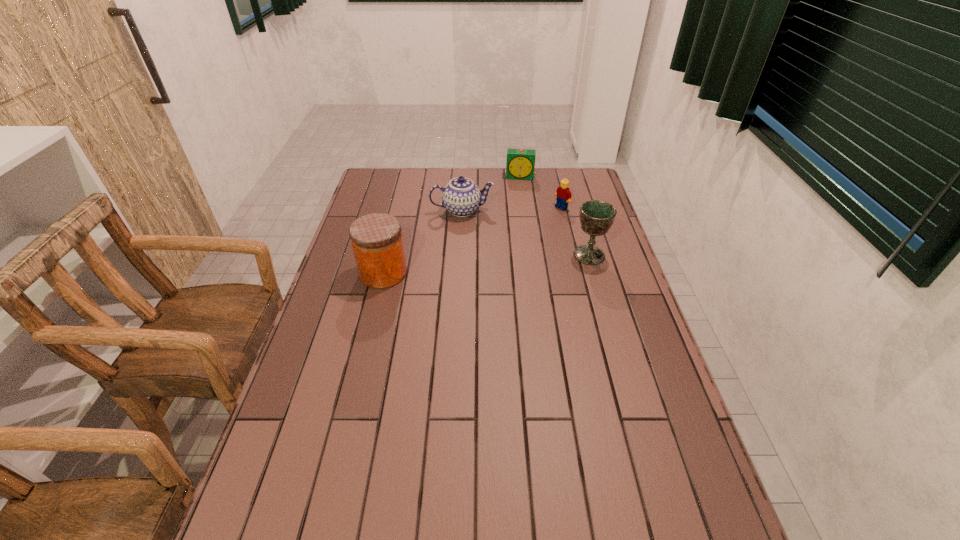
Identify the location of blank region between the chalice and the Lego. This screenshot has width=960, height=540. (575, 231).

Find the location of `empty space between the farthest object and the chalice`. empty space between the farthest object and the chalice is located at coordinates (555, 216).

At what (x,y) coordinates should I click in order to perform the action: click on blank region between the leftmost object and the second object from left to right. Please return your answer as a coordinate pair (x, y). Looking at the image, I should click on (422, 242).

You are a GUI agent. You are given a task and a screenshot of the screen. Output one action in this format:
    pyautogui.click(x=<x>, y=<y>)
    Task: Click on the unoccupied position between the third tallest object and the chalice
    The width and height of the screenshot is (960, 540).
    Given the screenshot: What is the action you would take?
    pyautogui.click(x=525, y=233)

The height and width of the screenshot is (540, 960). Find the location of `vacant space that is in between the leftmost object and the farthest object`. vacant space that is in between the leftmost object and the farthest object is located at coordinates (452, 225).

Where is `blank region between the chalice and the second object from left to right`? This screenshot has width=960, height=540. blank region between the chalice and the second object from left to right is located at coordinates (525, 233).

The width and height of the screenshot is (960, 540). Identify the location of the second closest object to the jar. (596, 217).

Identify which object is the third closest to the leftmost object. Please provide its 2D coordinates. Your answer should be formatted as a tuple, i.e. [(x, y)], where the tuple contains the x and y coordinates of a point satisfying the conditions above.

[(563, 194)]

You are a GUI agent. You are given a task and a screenshot of the screen. Output one action in this format:
    pyautogui.click(x=<x>, y=<y>)
    Task: Click on the blank space that satisfies the following two spatial constraints: 1. on the front side of the farthest object; 2. on the left side of the Lego
    
    Given the screenshot: What is the action you would take?
    pyautogui.click(x=524, y=207)

This screenshot has width=960, height=540. Find the location of `blank space that satisfies the following two spatial constraints: 1. on the back side of the chinaware; 2. on the right side of the leftmost object`. blank space that satisfies the following two spatial constraints: 1. on the back side of the chinaware; 2. on the right side of the leftmost object is located at coordinates (398, 211).